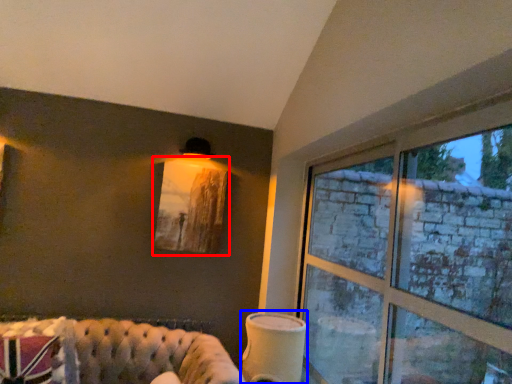
Question: Which object is closer to the camera taking this photo, picture frame (highlighted by a red box) or table lamp (highlighted by a blue box)?

Choices:
 (A) picture frame
 (B) table lamp

Answer: (B)